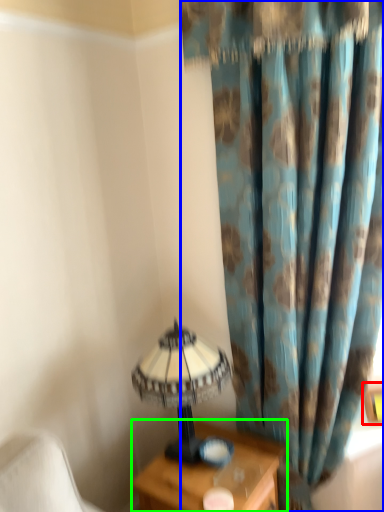
Question: Considering the real-world distances, which object is farthest from picture frame (highlighted by a red box)? curtain (highlighted by a blue box) or nightstand (highlighted by a green box)?

Choices:
 (A) curtain
 (B) nightstand

Answer: (A)